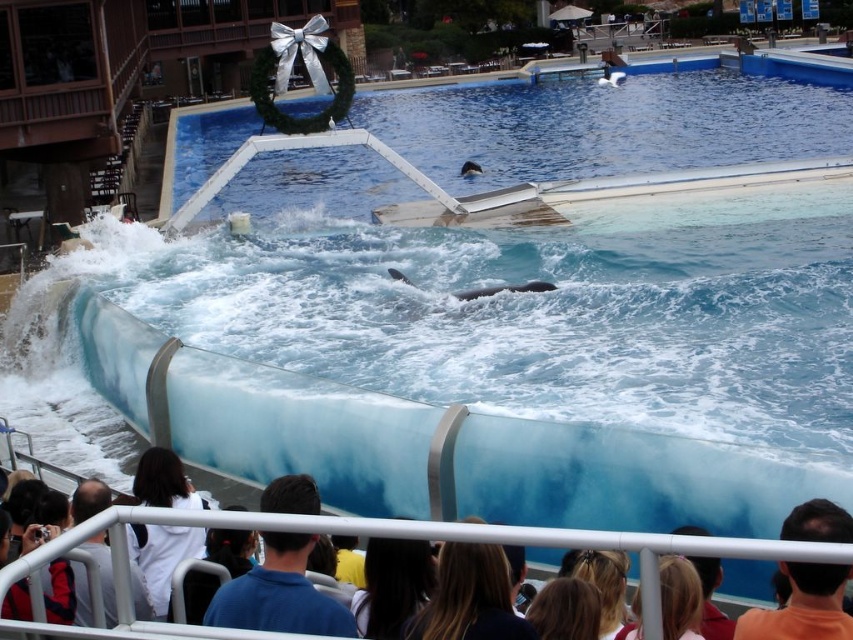
Question: Does black smooth whale at center appear on the right side of gray matte whale at center?

Choices:
 (A) no
 (B) yes

Answer: (A)

Question: Does gray matte dolphin at center have a larger size compared to gray matte whale at center?

Choices:
 (A) no
 (B) yes

Answer: (A)

Question: Does blue glossy water at upper center have a lesser width compared to black smooth whale at center?

Choices:
 (A) no
 (B) yes

Answer: (A)

Question: Among these objects, which one is nearest to the camera?

Choices:
 (A) blue glossy water at upper center
 (B) gray matte whale at center

Answer: (A)

Question: Which point is farther from the camera taking this photo?

Choices:
 (A) (405, 173)
 (B) (476, 291)
 (C) (529, 289)
 (D) (463, 168)

Answer: (D)

Question: Which point is farther to the camera?

Choices:
 (A) (494, 285)
 (B) (466, 300)

Answer: (A)